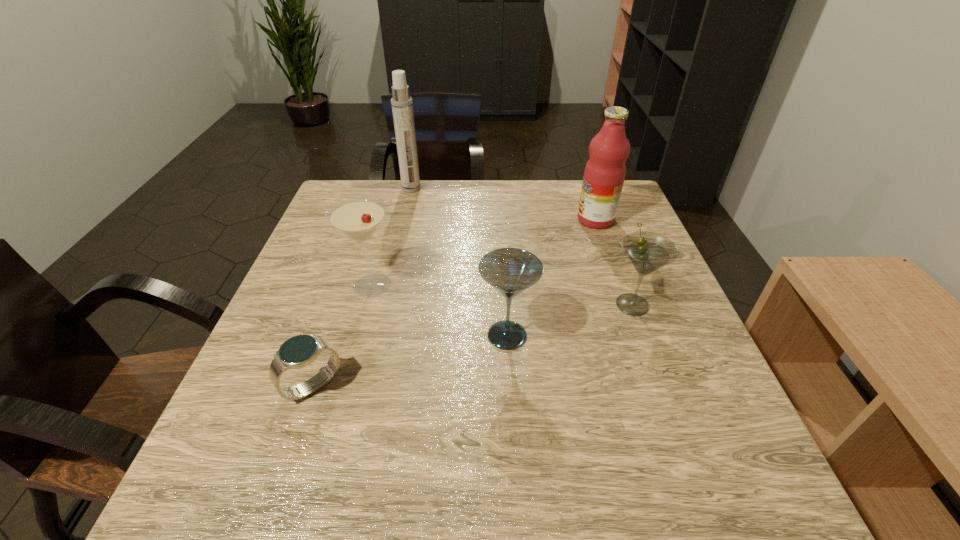
The height and width of the screenshot is (540, 960). Identify the location of martini that is the second nearest to the leftmost martini. 647,251.

What are the coordinates of `free location that satisfies the following two spatial constraints: 1. on the front side of the rightmost martini; 2. on the right side of the leftmost martini` in the screenshot? It's located at (367, 304).

Identify the location of free space that satisfies the following two spatial constraints: 1. on the front side of the leftmost martini; 2. on the right side of the second martini from left to right. The height and width of the screenshot is (540, 960). (358, 336).

Image resolution: width=960 pixels, height=540 pixels. Identify the location of free location that satisfies the following two spatial constraints: 1. on the front side of the aerosol can; 2. on the left side of the rightmost martini. (384, 304).

Where is `free region that satisfies the following two spatial constraints: 1. on the front side of the leftmost martini; 2. on the right side of the second martini from right to left`? This screenshot has width=960, height=540. free region that satisfies the following two spatial constraints: 1. on the front side of the leftmost martini; 2. on the right side of the second martini from right to left is located at coordinates (358, 336).

The width and height of the screenshot is (960, 540). In order to click on vacant position in the image that satisfies the following two spatial constraints: 1. on the back side of the rightmost martini; 2. on the label of the fruit juice in this screenshot , I will do `click(601, 220)`.